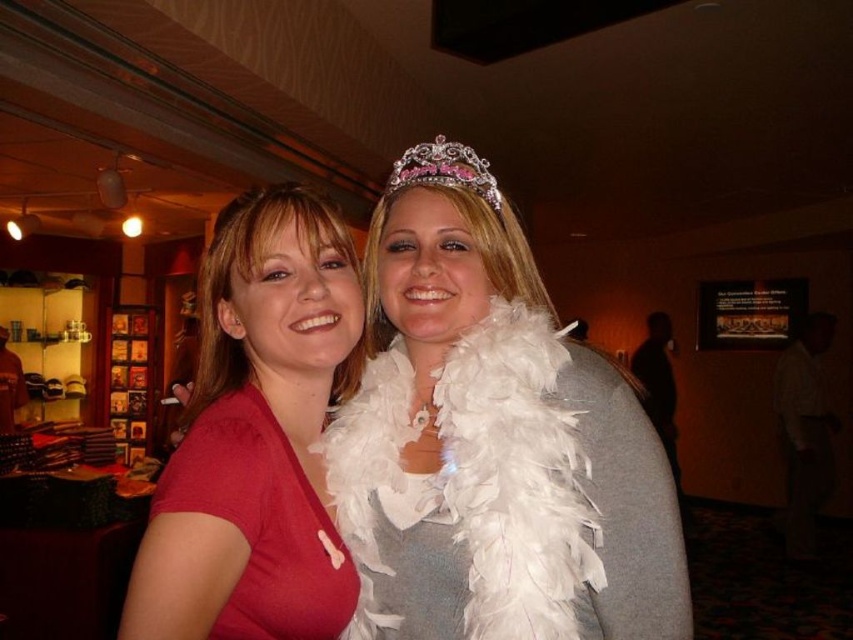
You are at a social event and want to take a photo with both the person on the left and the person on the right. However, there are two points marked in the image. One is at coordinate point (468, 272) and the other is at coordinate point (264, 428). Which point should you stand at to ensure both people are in the frame without any obstruction?

You should stand at point (264, 428) because point (468, 272) is behind point (264, 428), so standing at the latter will allow both individuals to be visible without obstruction.

You are a photographer at the event and want to capture a clear photo of both the matte red dress at left and the white feather boa at center without any obstruction. Based on their positions, which object should you adjust your focus to ensure it is in the foreground?

The white feather boa at center should be in focus since it is in the foreground, while the matte red dress at left is behind it.

You are a photographer adjusting the camera settings to capture a clear photo of both the matte red shirt at center and the sparkly pink tiara at upper center. The camera has a depth of field that can focus on objects within a 12 inch range. Will both objects be in focus?

The matte red shirt at center is 13.03 inches away from the sparkly pink tiara at upper center. Since the distance between them exceeds the camera s 12 inch depth of field range, at least one of the objects will be out of focus.